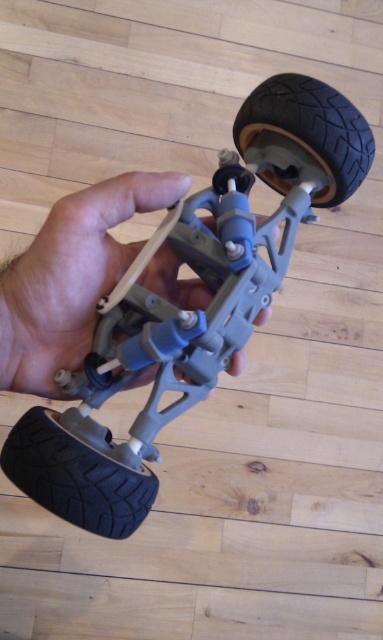
Can you confirm if gray matte plastic hand at center is shorter than black rubber tire at upper right?

Incorrect, gray matte plastic hand at center's height does not fall short of black rubber tire at upper right's.

Does point (176, 275) lie behind point (250, 132)?

No, (176, 275) is in front of (250, 132).

You are a GUI agent. You are given a task and a screenshot of the screen. Output one action in this format:
    pyautogui.click(x=<x>, y=<y>)
    Task: Click on the gray matte plastic hand at center
    The width and height of the screenshot is (383, 640).
    Given the screenshot: What is the action you would take?
    pyautogui.click(x=70, y=276)

Between point (173, 323) and point (13, 444), which one is positioned behind?

The point (13, 444) is behind.

Is point (324, 144) positioned after point (22, 426)?

That is True.

Identify the location of matte gray plastic toy car at center. (191, 310).

Does matte gray plastic toy car at center have a greater width compared to black rubber tire at upper right?

Yes.

How distant is matte gray plastic toy car at center from black rubber tire at upper right?

4.83 inches

I want to click on matte gray plastic toy car at center, so click(191, 310).